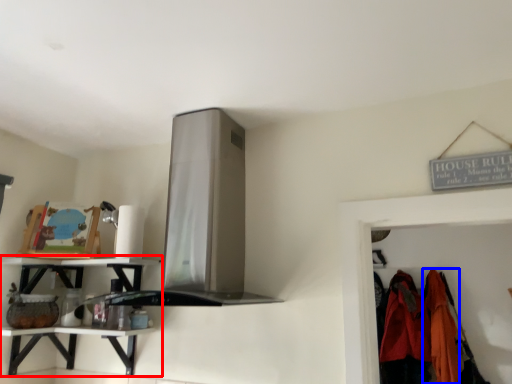
Question: Which point is closer to the camera, shelf (highlighted by a red box) or clothing (highlighted by a blue box)?

Choices:
 (A) shelf
 (B) clothing

Answer: (A)